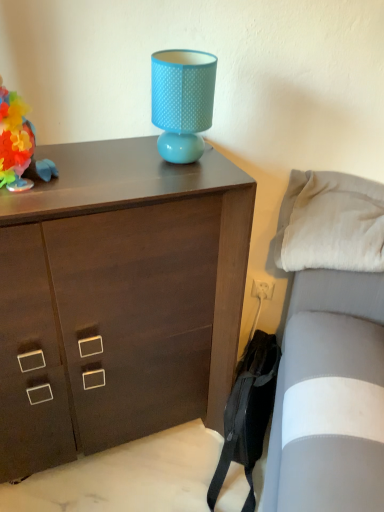
Question: Does white soft pillow at right have a larger size compared to multicolored paper flower at left?

Choices:
 (A) no
 (B) yes

Answer: (B)

Question: Is white soft pillow at right outside multicolored paper flower at left?

Choices:
 (A) yes
 (B) no

Answer: (A)

Question: From the image's perspective, is white soft pillow at right on top of multicolored paper flower at left?

Choices:
 (A) yes
 (B) no

Answer: (B)

Question: Is white soft pillow at right facing towards multicolored paper flower at left?

Choices:
 (A) no
 (B) yes

Answer: (A)

Question: From the image's perspective, is white soft pillow at right below multicolored paper flower at left?

Choices:
 (A) no
 (B) yes

Answer: (B)

Question: Is point (26, 180) positioned closer to the camera than point (119, 301)?

Choices:
 (A) closer
 (B) farther

Answer: (A)

Question: Would you say multicolored paper flower at left is to the left or to the right of dark wood chest of drawers at upper center in the picture?

Choices:
 (A) right
 (B) left

Answer: (B)

Question: From a real-world perspective, is multicolored paper flower at left above or below dark wood chest of drawers at upper center?

Choices:
 (A) above
 (B) below

Answer: (A)

Question: Is multicolored paper flower at left inside the boundaries of dark wood chest of drawers at upper center, or outside?

Choices:
 (A) inside
 (B) outside

Answer: (B)

Question: Is white soft pillow at right taller or shorter than dark wood chest of drawers at upper center?

Choices:
 (A) tall
 (B) short

Answer: (B)

Question: Considering the positions of white soft pillow at right and dark wood chest of drawers at upper center in the image, is white soft pillow at right wider or thinner than dark wood chest of drawers at upper center?

Choices:
 (A) wide
 (B) thin

Answer: (B)

Question: Looking at the image, does white soft pillow at right seem bigger or smaller compared to dark wood chest of drawers at upper center?

Choices:
 (A) small
 (B) big

Answer: (A)

Question: In the image, is white soft pillow at right on the left side or the right side of dark wood chest of drawers at upper center?

Choices:
 (A) right
 (B) left

Answer: (A)

Question: Is point (339, 251) positioned closer to the camera than point (182, 145)?

Choices:
 (A) farther
 (B) closer

Answer: (A)

Question: Which is correct: white soft pillow at right is inside matte blue lampshade at upper center, or outside of it?

Choices:
 (A) inside
 (B) outside

Answer: (B)